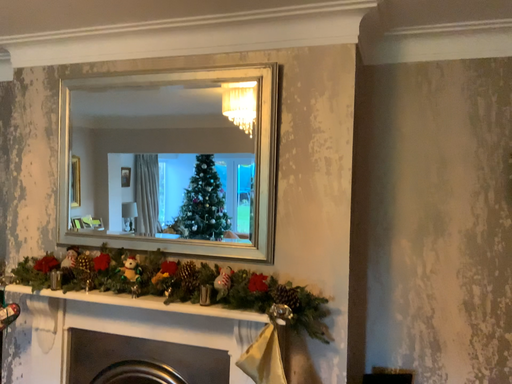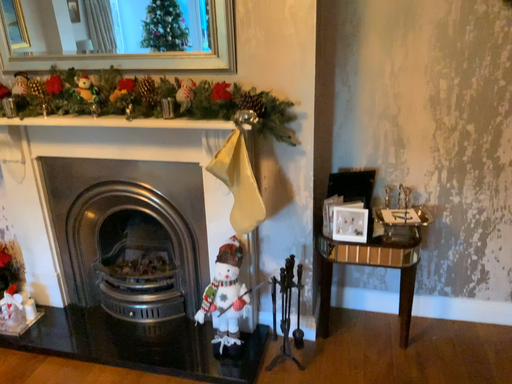
Question: Which way did the camera rotate in the video?

Choices:
 (A) rotated downward
 (B) rotated upward

Answer: (A)